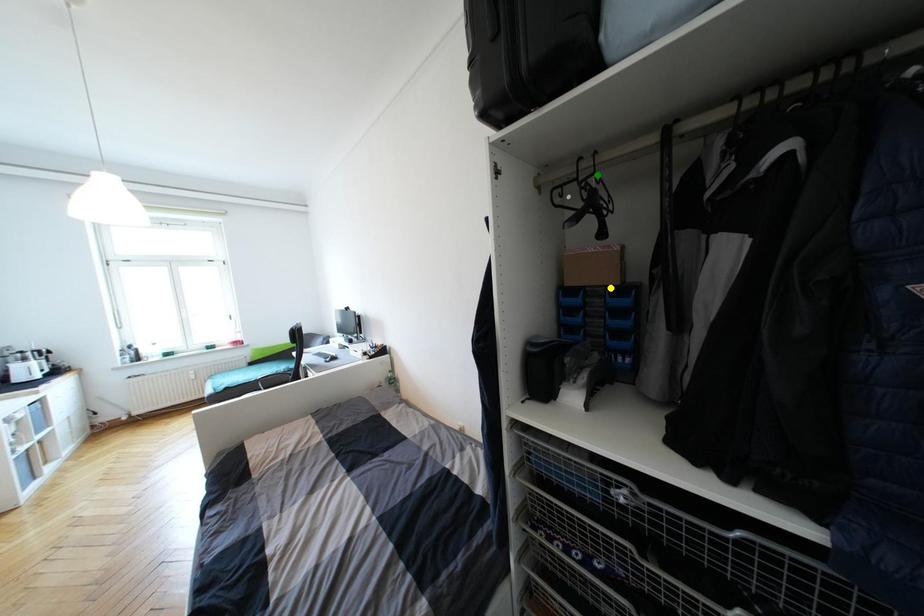
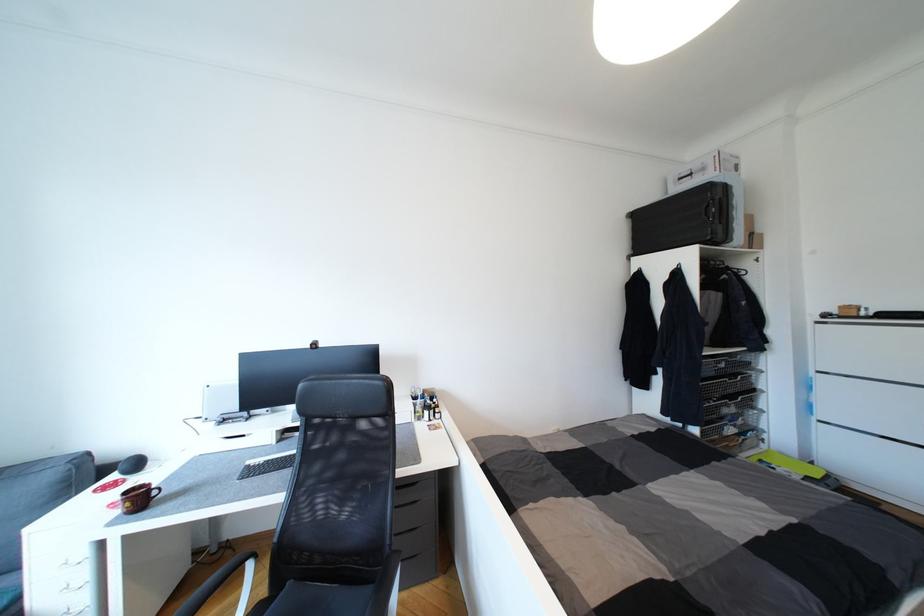
I am providing you with two images of the same scene from different viewpoints. Three points are marked in image1. Which point corresponds to a part or object that is occluded in image2?In image1, three points are marked. Which of them correspond to a part or object that is occluded in image2?Among the three points shown in image1, which one corresponds to a part or object that is no longer visible due to occlusion in image2?

blue point, yellow point, green point